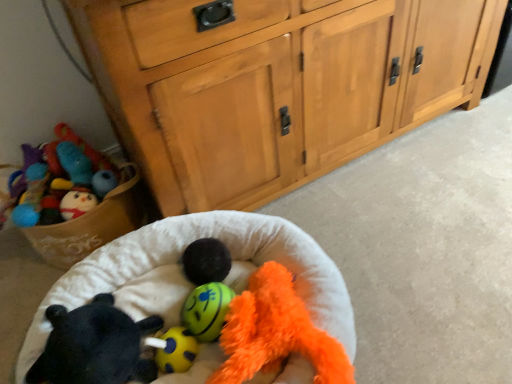
I want to click on vacant area on top of fluffy orange stuffed animal at center, which is the first toy from right to left (from a real-world perspective), so click(x=271, y=322).